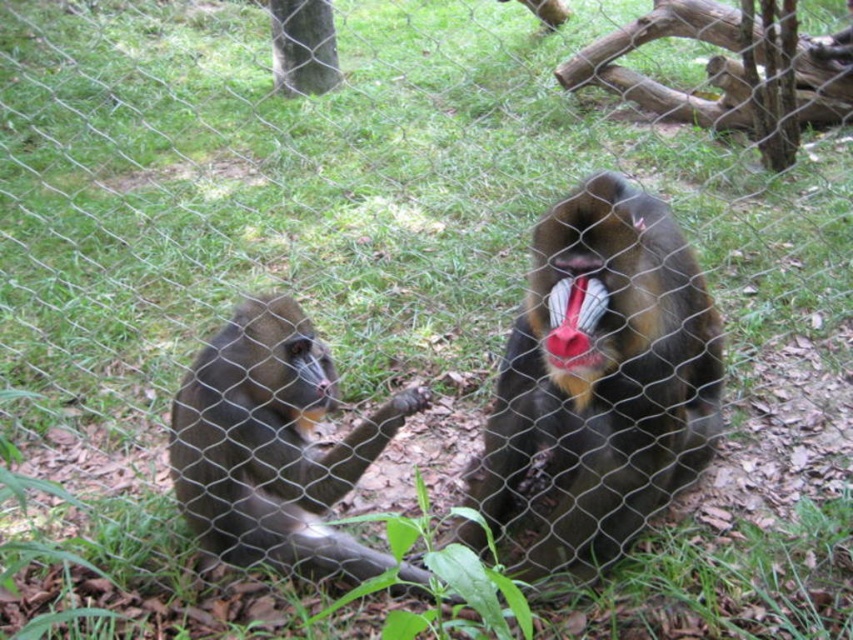
Question: Which point is farther from the camera taking this photo?

Choices:
 (A) (640, 394)
 (B) (346, 570)
 (C) (579, 284)

Answer: (B)

Question: Which object appears farthest from the camera in this image?

Choices:
 (A) brown furry monkey at left
 (B) shiny brown monkey at center
 (C) bright red fur at mouth right

Answer: (A)

Question: Is brown furry monkey at left bigger than bright red fur at mouth right?

Choices:
 (A) no
 (B) yes

Answer: (B)

Question: Can you confirm if shiny brown monkey at center is positioned below brown furry monkey at left?

Choices:
 (A) yes
 (B) no

Answer: (B)

Question: Which point appears closest to the camera in this image?

Choices:
 (A) (279, 566)
 (B) (589, 460)

Answer: (B)

Question: Is shiny brown monkey at center further to the viewer compared to bright red fur at mouth right?

Choices:
 (A) yes
 (B) no

Answer: (B)